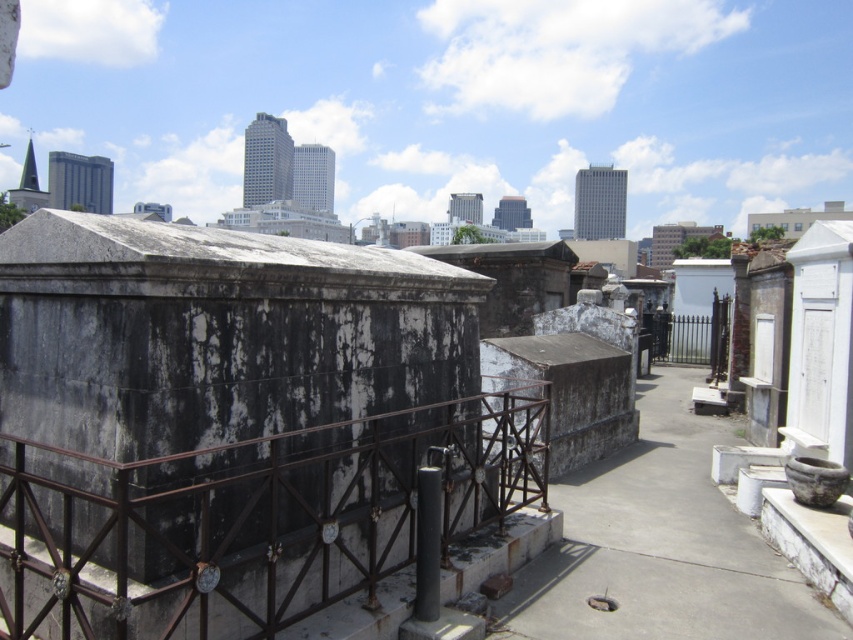
Is rusty metal railing at center positioned at the back of gray concrete pavement at center?

No, it is not.

Can you confirm if rusty metal railing at center is positioned to the right of gray concrete pavement at center?

In fact, rusty metal railing at center is to the left of gray concrete pavement at center.

Is point (71, 502) closer to viewer compared to point (619, 483)?

Yes, it is in front of point (619, 483).

The width and height of the screenshot is (853, 640). I want to click on rusty metal railing at center, so click(x=253, y=518).